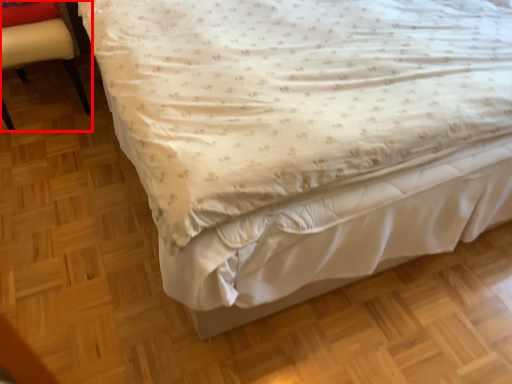
Question: Where is chair (annotated by the red box) located in relation to pillow in the image?

Choices:
 (A) right
 (B) left

Answer: (B)